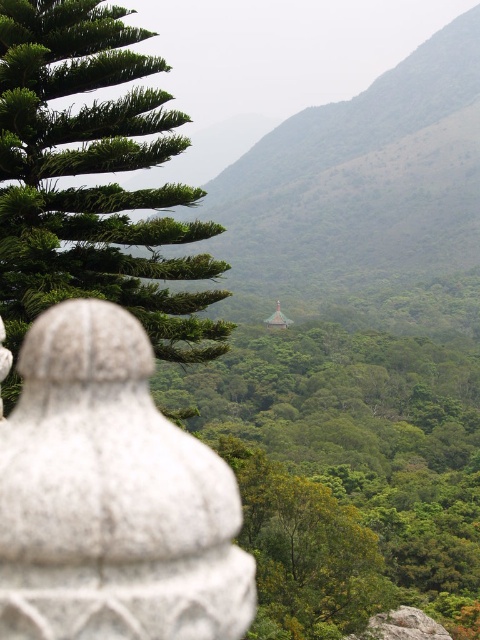
Who is more distant from viewer, (398, 449) or (110, 49)?

The point (398, 449) is behind.

Can you confirm if green leafy tree at center is smaller than green leafy tree at upper left?

Actually, green leafy tree at center might be larger than green leafy tree at upper left.

Who is more distant from viewer, (294, 424) or (12, 136)?

The point (294, 424) is more distant.

Where is `green leafy tree at center`? green leafy tree at center is located at coordinates (347, 472).